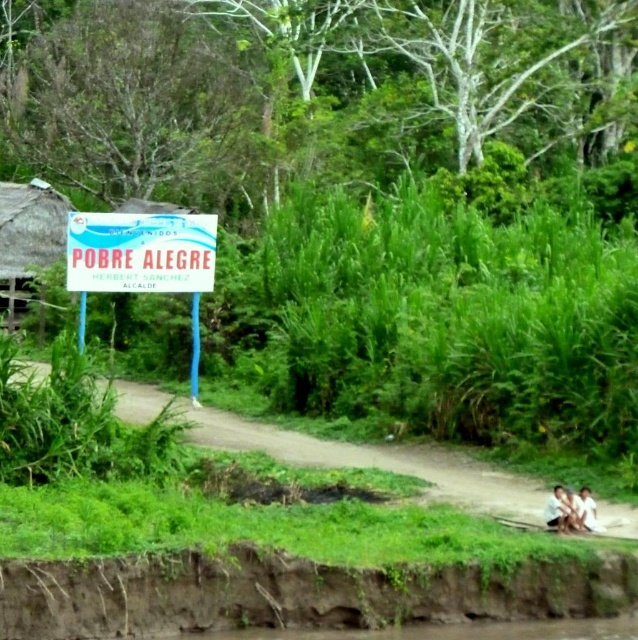
Question: Which point appears farthest from the camera in this image?

Choices:
 (A) tap(568, 493)
 (B) tap(542, 564)
 (C) tap(591, 497)
 (D) tap(197, 259)

Answer: (D)

Question: Which point appears farthest from the camera in this image?

Choices:
 (A) (186, 236)
 (B) (195, 236)

Answer: (B)

Question: Which point appears farthest from the camera in this image?

Choices:
 (A) (591, 525)
 (B) (193, 300)
 (C) (554, 524)

Answer: (B)

Question: Is white plastic sign at left further to the viewer compared to white plastic sign at upper left?

Choices:
 (A) yes
 (B) no

Answer: (A)

Question: Can you confirm if white plastic sign at upper left is wider than brown textured fabric at lower right?

Choices:
 (A) no
 (B) yes

Answer: (B)

Question: Is brown dirt river bank at lower left smaller than white cotton shirt at lower right?

Choices:
 (A) yes
 (B) no

Answer: (B)